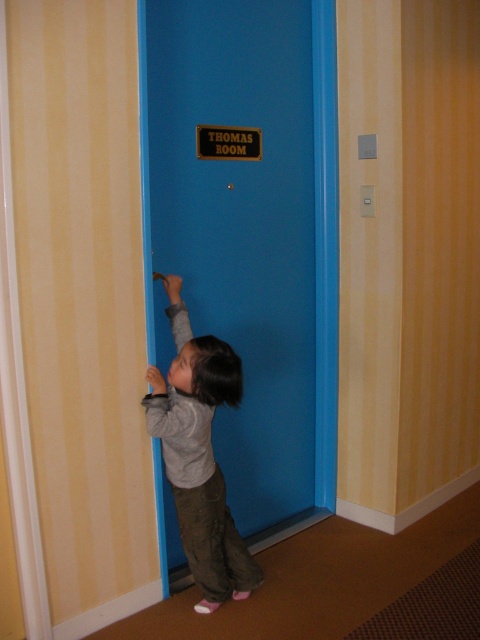
Who is lower down, blue matte door at center or gray cotton shirt at center?

gray cotton shirt at center is below.

Can you confirm if blue matte door at center is positioned below gray cotton shirt at center?

Incorrect, blue matte door at center is not positioned below gray cotton shirt at center.

At what (x,y) coordinates should I click in order to perform the action: click on blue matte door at center. Please return your answer as a coordinate pair (x, y). Looking at the image, I should click on (241, 227).